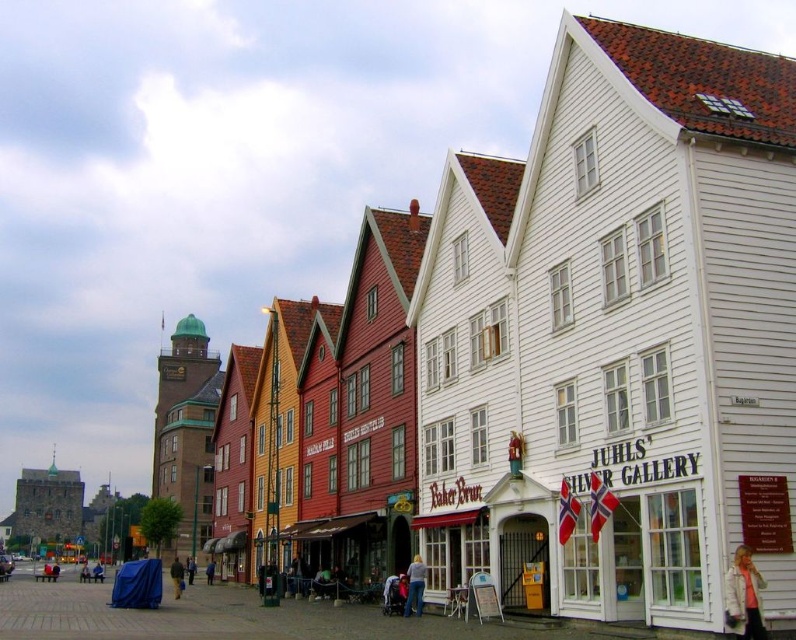
The image size is (796, 640). Describe the element at coordinates (416, 586) in the screenshot. I see `light blue jeans at center` at that location.

Does light blue jeans at center have a greater width compared to yellow fabric bag at lower left?

In fact, light blue jeans at center might be narrower than yellow fabric bag at lower left.

Is point (420, 611) positioned behind point (178, 579)?

No, it is not.

Locate an element on the screen. Image resolution: width=796 pixels, height=640 pixels. light blue jeans at center is located at coordinates (416, 586).

Is white fabric jacket at lower right positioned at the back of yellow fabric bag at lower left?

No.

Measure the distance between white fabric jacket at lower right and camera.

A distance of 35.39 meters exists between white fabric jacket at lower right and camera.

Locate an element on the screen. This screenshot has height=640, width=796. white fabric jacket at lower right is located at coordinates (743, 596).

Who is taller, light blue jeans at center or blue fabric at center?

With more height is blue fabric at center.

Is light blue jeans at center taller than blue fabric at center?

No, light blue jeans at center is not taller than blue fabric at center.

Who is more distant from viewer, (416, 605) or (205, 568)?

Point (205, 568)

Find the location of a particular element. light blue jeans at center is located at coordinates (416, 586).